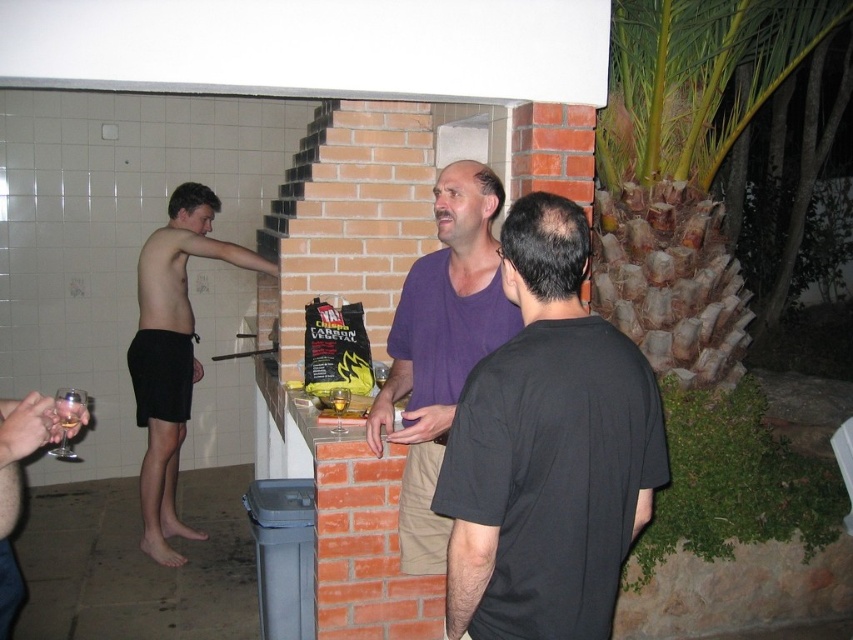
Is purple cotton shirt at center thinner than black shorts at left?

Yes, purple cotton shirt at center is thinner than black shorts at left.

Can you confirm if purple cotton shirt at center is bigger than black shorts at left?

Actually, purple cotton shirt at center might be smaller than black shorts at left.

Is point (457, 394) farther from viewer compared to point (157, 528)?

No, (457, 394) is closer to viewer.

The height and width of the screenshot is (640, 853). Find the location of `purple cotton shirt at center`. purple cotton shirt at center is located at coordinates (440, 348).

Which is in front, point (546, 448) or point (200, 193)?

Positioned in front is point (546, 448).

Where is `purple matte shirt at center`? purple matte shirt at center is located at coordinates pyautogui.click(x=547, y=449).

Does point (479, 440) come in front of point (450, 182)?

That is True.

From the picture: Can you confirm if purple matte shirt at center is positioned below purple cotton shirt at center?

Correct, purple matte shirt at center is located below purple cotton shirt at center.

At what (x,y) coordinates should I click in order to perform the action: click on purple matte shirt at center. Please return your answer as a coordinate pair (x, y). Looking at the image, I should click on (547, 449).